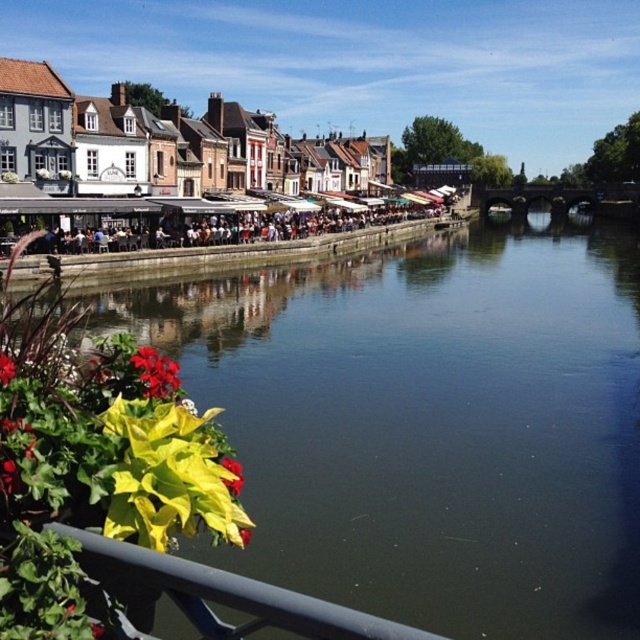
Is point (424, 252) behind point (161, 390)?

Yes, it is behind point (161, 390).

Does greenish-brown water at center have a greater height compared to vivid red petals at lower left?

Indeed, greenish-brown water at center has a greater height compared to vivid red petals at lower left.

Where is `greenish-brown water at center`? This screenshot has height=640, width=640. greenish-brown water at center is located at coordinates (429, 422).

Which is above, vivid red petals at lower left or yellow-green leaf at lower left?

Positioned higher is vivid red petals at lower left.

Does vivid red petals at lower left have a lesser height compared to yellow-green leaf at lower left?

No.

Which is behind, point (145, 364) or point (228, 486)?

Point (145, 364)

This screenshot has width=640, height=640. In order to click on vivid red petals at lower left in this screenshot , I will do `click(156, 372)`.

Between vivid red petals at lower left and red matte flower at lower left, which one appears on the right side from the viewer's perspective?

Positioned to the right is vivid red petals at lower left.

Based on the photo, can you confirm if vivid red petals at lower left is shorter than red matte flower at lower left?

No, vivid red petals at lower left is not shorter than red matte flower at lower left.

Between point (172, 362) and point (10, 378), which one is positioned behind?

The point (172, 362) is more distant.

Identify the location of vivid red petals at lower left. (156, 372).